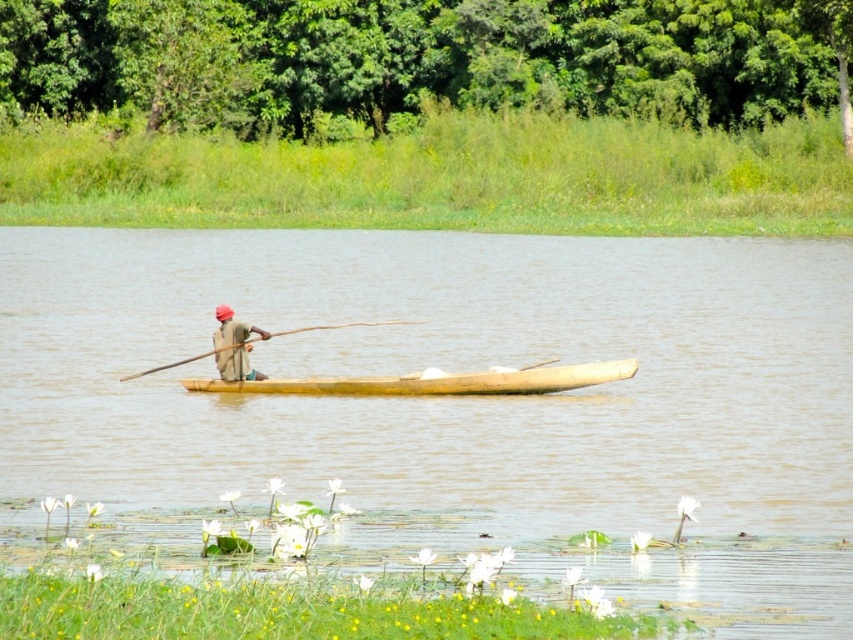
From the picture: Is brown wooden boat at center further to camera compared to wooden at center?

No, it is not.

Who is more forward, (503, 342) or (171, 362)?

Positioned in front is point (171, 362).

Locate an element on the screen. Image resolution: width=853 pixels, height=640 pixels. brown wooden boat at center is located at coordinates (456, 396).

Is light brown wooden canoe at center bigger than matte brown canoe at center?

Correct, light brown wooden canoe at center is larger in size than matte brown canoe at center.

Can you confirm if light brown wooden canoe at center is smaller than matte brown canoe at center?

Actually, light brown wooden canoe at center might be larger than matte brown canoe at center.

The image size is (853, 640). Identify the location of light brown wooden canoe at center. (434, 381).

Is brown wooden boat at center shorter than light brown wooden canoe at center?

No.

The image size is (853, 640). In order to click on brown wooden boat at center in this screenshot , I will do `click(456, 396)`.